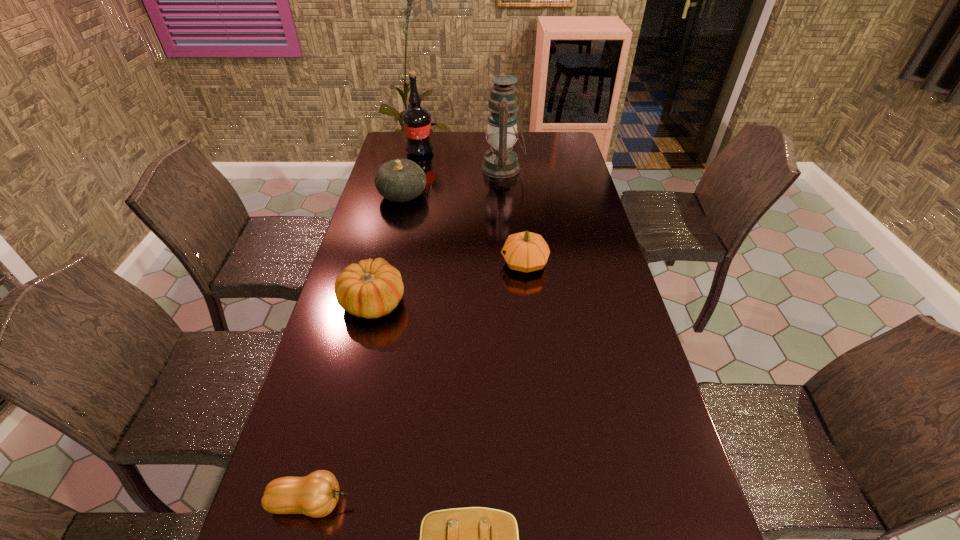
You are a GUI agent. You are given a task and a screenshot of the screen. Output one action in this format:
    pyautogui.click(x=<x>, y=<y>)
    Task: Click on the free spot located on the right of the farthest gourd
    The height and width of the screenshot is (540, 960).
    Given the screenshot: What is the action you would take?
    pyautogui.click(x=500, y=195)

Image resolution: width=960 pixels, height=540 pixels. What are the coordinates of `vacant region located 0.090m on the side of the rightmost gourd with the carved face` in the screenshot? It's located at (473, 263).

Where is `vacant space located 0.050m on the side of the rightmost gourd with the carved face`? This screenshot has width=960, height=540. vacant space located 0.050m on the side of the rightmost gourd with the carved face is located at coordinates (485, 263).

Where is `vacant region located on the side of the rightmost gourd with the carved face`? Image resolution: width=960 pixels, height=540 pixels. vacant region located on the side of the rightmost gourd with the carved face is located at coordinates (485, 263).

This screenshot has width=960, height=540. I want to click on vacant space located 0.230m on the right of the fifth farthest object, so click(x=483, y=302).

You are a GUI agent. You are given a task and a screenshot of the screen. Output one action in this format:
    pyautogui.click(x=<x>, y=<y>)
    Task: Click on the vacant area situated 0.250m on the stem side of the nearest gourd
    This screenshot has height=540, width=960.
    Given the screenshot: What is the action you would take?
    pyautogui.click(x=473, y=502)

Where is `oil lamp that is at the far edge`? This screenshot has width=960, height=540. oil lamp that is at the far edge is located at coordinates [x=500, y=162].

This screenshot has height=540, width=960. Find the location of `wine bottle that is at the far edge`. wine bottle that is at the far edge is located at coordinates [417, 121].

You are a GUI agent. You are given a task and a screenshot of the screen. Output one action in this format:
    pyautogui.click(x=<x>, y=<y>)
    Task: Click on the wine bottle present at the left edge
    This screenshot has width=960, height=540.
    Given the screenshot: What is the action you would take?
    pyautogui.click(x=417, y=121)

What are the coordinates of `object located in the far left corner section of the desktop` in the screenshot? It's located at (417, 121).